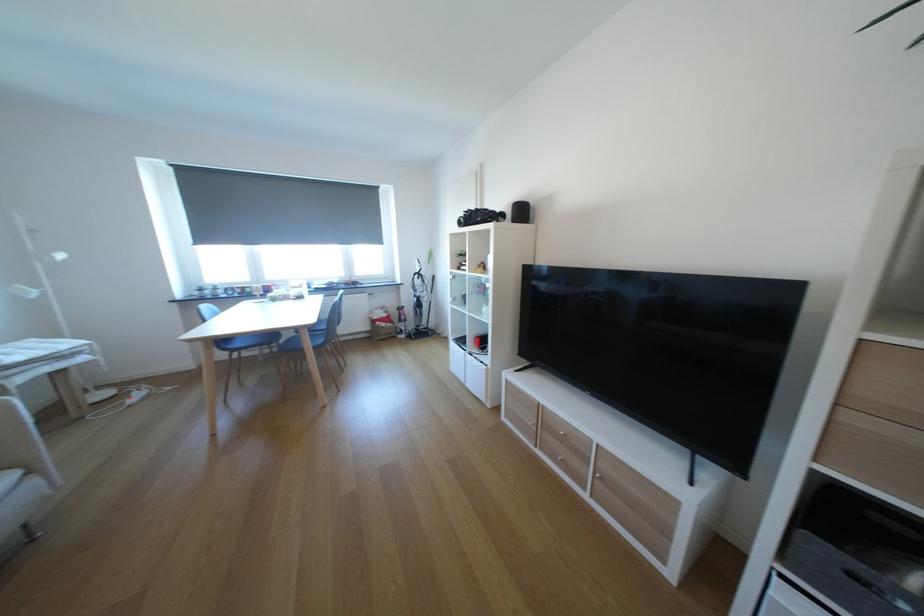
The image size is (924, 616). Describe the element at coordinates (43, 270) in the screenshot. I see `the lamp head` at that location.